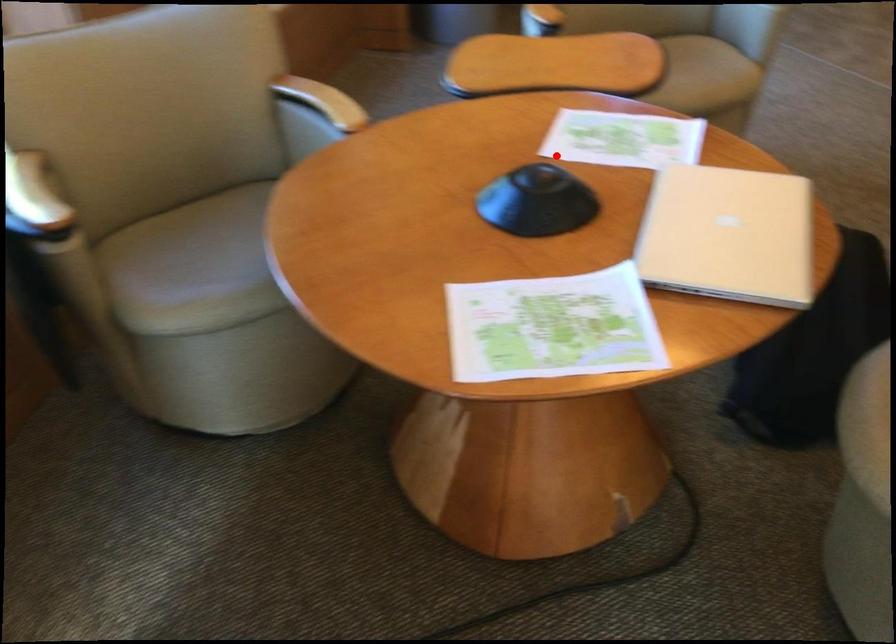
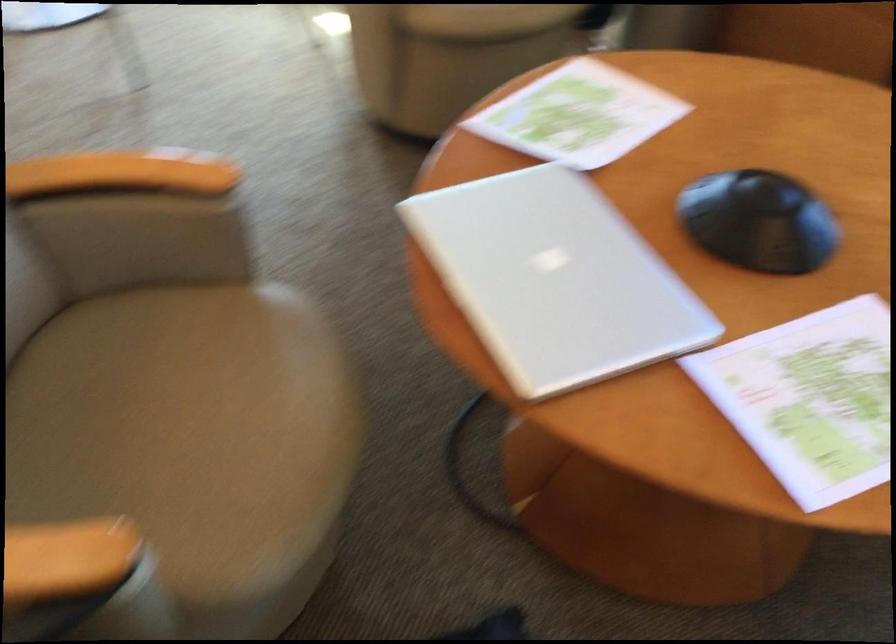
Question: I am providing you with two images of the same scene from different viewpoints. A red point is shown in image1. For the corresponding object point in image2, is it positioned nearer or farther from the camera?

Choices:
 (A) Nearer
 (B) Farther

Answer: (A)